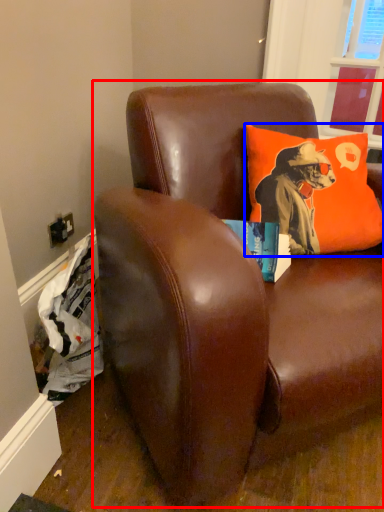
Question: Which object appears closest to the camera in this image, studio couch (highlighted by a red box) or pillow (highlighted by a blue box)?

Choices:
 (A) studio couch
 (B) pillow

Answer: (A)